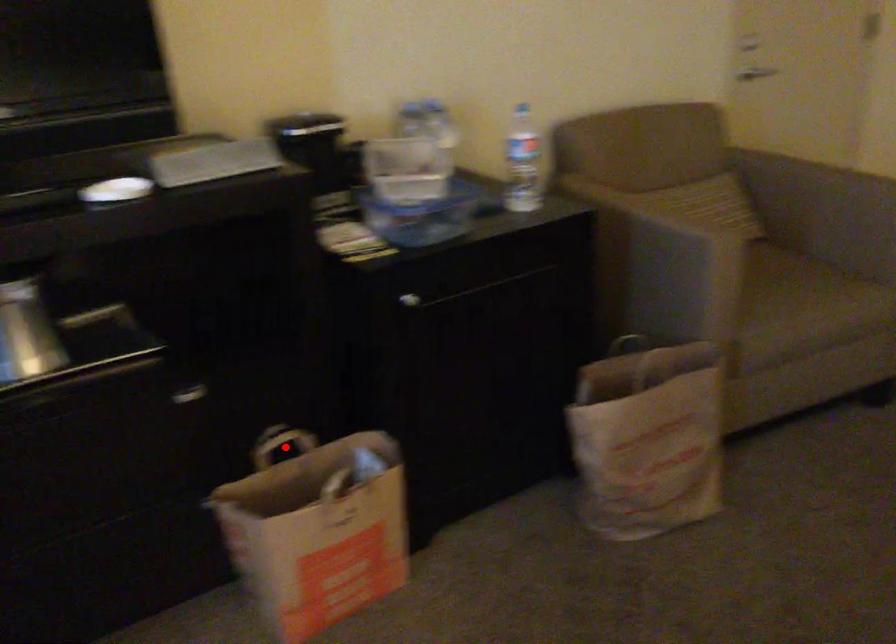
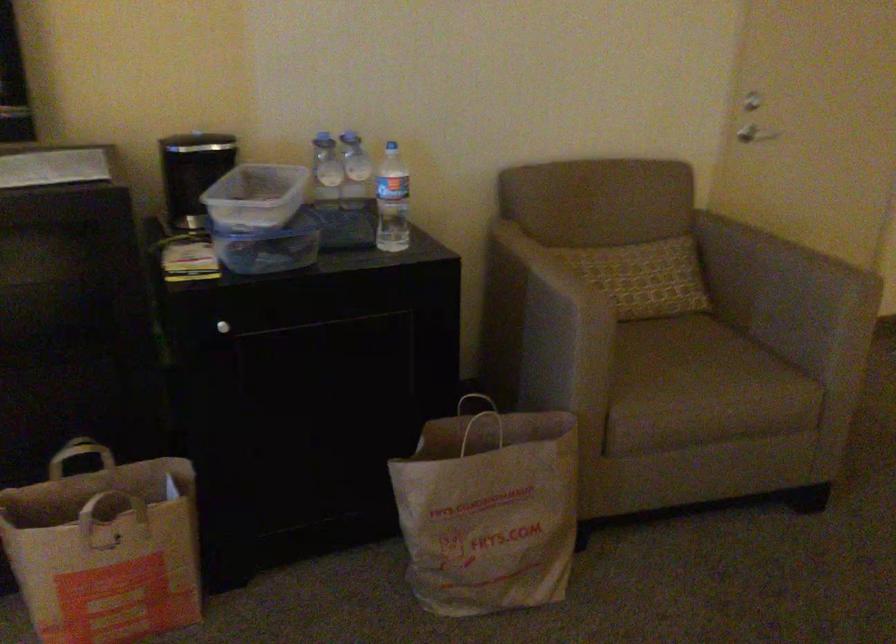
Locate, in the second image, the point that corresponds to the highlighted location in the first image.

(82, 458)